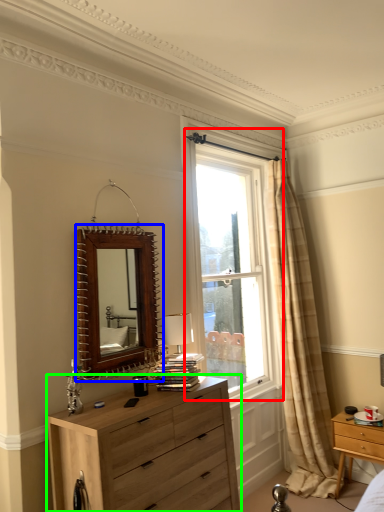
Question: Which is nearer to the window (highlighted by a red box)? mirror (highlighted by a blue box) or chest of drawers (highlighted by a green box).

Choices:
 (A) mirror
 (B) chest of drawers

Answer: (A)